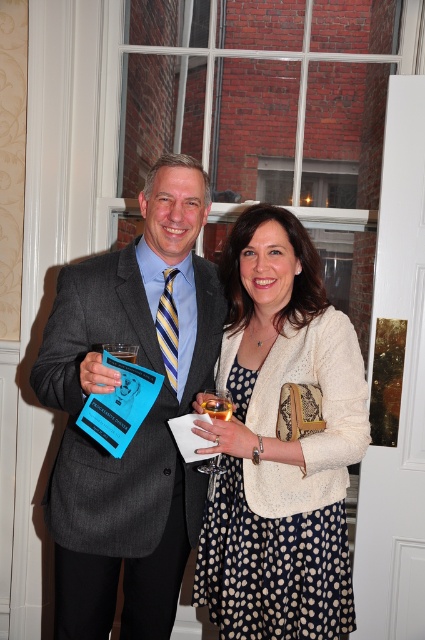
You are at a social event and want to move from the point closer to you to the point further away. Which path should you take between the two points, point (73, 442) and point (227, 394)?

You should move from point (73, 442) to point (227, 394) because point (73, 442) is closer to you and point (227, 394) is further away.

You are at a social gathering and see the gray wool suit at center and the clear glass wine glass at center. Which object is positioned to the right side?

The clear glass wine glass at center is positioned to the right of the gray wool suit at center.